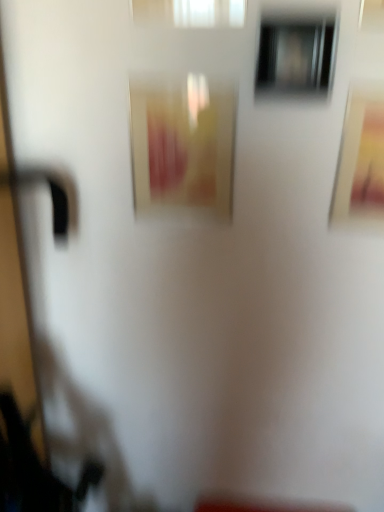
Find the location of a particular element. This screenshot has width=384, height=512. white translucent curtain at upper center, the 1th window when ordered from left to right is located at coordinates (191, 12).

Locate an element on the screen. The image size is (384, 512). matte gold picture frame at upper right, placed as the second picture frame when sorted from left to right is located at coordinates (360, 159).

Locate an element on the screen. The image size is (384, 512). transparent glass window at upper center, marked as the second window in a top-to-bottom arrangement is located at coordinates (296, 54).

What is the approximate width of transparent glass window at upper center, marked as the second window in a top-to-bottom arrangement?

It is 0.95 inches.

In order to click on white translucent curtain at upper center, acting as the 2th window starting from the bottom in this screenshot , I will do `click(191, 12)`.

Is matte yellow picture frame at center, the 1th picture frame positioned from the left, bigger or smaller than white translucent curtain at upper center, acting as the 2th window starting from the bottom?

Clearly, matte yellow picture frame at center, the 1th picture frame positioned from the left, is larger in size than white translucent curtain at upper center, acting as the 2th window starting from the bottom.

Could white translucent curtain at upper center, the 1th window when ordered from left to right, be considered to be inside matte yellow picture frame at center, placed as the second picture frame when sorted from right to left?

That's incorrect, white translucent curtain at upper center, the 1th window when ordered from left to right, is not inside matte yellow picture frame at center, placed as the second picture frame when sorted from right to left.

Consider the image. Are matte yellow picture frame at center, the 1th picture frame positioned from the left, and white translucent curtain at upper center, which ranks as the second window in right-to-left order, far apart?

They are positioned close to each other.

Which is more to the left, matte yellow picture frame at center, placed as the second picture frame when sorted from right to left, or matte gold picture frame at upper right, which is the 1th picture frame from right to left?

From the viewer's perspective, matte yellow picture frame at center, placed as the second picture frame when sorted from right to left, appears more on the left side.

Looking at this image, from a real-world perspective, is matte yellow picture frame at center, the 1th picture frame positioned from the left, physically below matte gold picture frame at upper right, which is the 1th picture frame from right to left?

Yes, from a real-world perspective, matte yellow picture frame at center, the 1th picture frame positioned from the left, is under matte gold picture frame at upper right, which is the 1th picture frame from right to left.

Does matte yellow picture frame at center, the 1th picture frame positioned from the left, come behind matte gold picture frame at upper right, placed as the second picture frame when sorted from left to right?

Yes, the depth of matte yellow picture frame at center, the 1th picture frame positioned from the left, is greater than that of matte gold picture frame at upper right, placed as the second picture frame when sorted from left to right.

Consider the image. Who is bigger, matte yellow picture frame at center, the 1th picture frame positioned from the left, or matte gold picture frame at upper right, placed as the second picture frame when sorted from left to right?

Bigger between the two is matte yellow picture frame at center, the 1th picture frame positioned from the left.

Is matte yellow picture frame at center, placed as the second picture frame when sorted from right to left, completely or partially inside white translucent curtain at upper center, which ranks as the second window in right-to-left order?

No, white translucent curtain at upper center, which ranks as the second window in right-to-left order, does not contain matte yellow picture frame at center, placed as the second picture frame when sorted from right to left.

Is white translucent curtain at upper center, the 1th window viewed from the top, next to matte yellow picture frame at center, the 1th picture frame positioned from the left, and touching it?

No, white translucent curtain at upper center, the 1th window viewed from the top, is not with matte yellow picture frame at center, the 1th picture frame positioned from the left.

I want to click on the 1st window counting from the right of the matte yellow picture frame at center, the 1th picture frame positioned from the left, so click(x=191, y=12).

In terms of width, does matte gold picture frame at upper right, which is the 1th picture frame from right to left, look wider or thinner when compared to white translucent curtain at upper center, which ranks as the second window in right-to-left order?

matte gold picture frame at upper right, which is the 1th picture frame from right to left, is wider than white translucent curtain at upper center, which ranks as the second window in right-to-left order.

Who is smaller, matte gold picture frame at upper right, placed as the second picture frame when sorted from left to right, or white translucent curtain at upper center, the 1th window when ordered from left to right?

Smaller between the two is matte gold picture frame at upper right, placed as the second picture frame when sorted from left to right.

How far apart are matte gold picture frame at upper right, placed as the second picture frame when sorted from left to right, and white translucent curtain at upper center, which ranks as the second window in right-to-left order?

They are 15.07 inches apart.

From a real-world perspective, is matte gold picture frame at upper right, which is the 1th picture frame from right to left, below white translucent curtain at upper center, which ranks as the second window in right-to-left order?

Yes, from a real-world perspective, matte gold picture frame at upper right, which is the 1th picture frame from right to left, is below white translucent curtain at upper center, which ranks as the second window in right-to-left order.

Is matte gold picture frame at upper right, which is the 1th picture frame from right to left, taller or shorter than transparent glass window at upper center, the 1th window in the right-to-left sequence?

matte gold picture frame at upper right, which is the 1th picture frame from right to left, is taller than transparent glass window at upper center, the 1th window in the right-to-left sequence.

From the picture: Considering the sizes of objects matte gold picture frame at upper right, placed as the second picture frame when sorted from left to right, and transparent glass window at upper center, which appears as the 1th window when ordered from the bottom, in the image provided, who is thinner, matte gold picture frame at upper right, placed as the second picture frame when sorted from left to right, or transparent glass window at upper center, which appears as the 1th window when ordered from the bottom,?

Thinner between the two is matte gold picture frame at upper right, placed as the second picture frame when sorted from left to right.

Is matte gold picture frame at upper right, which is the 1th picture frame from right to left, in contact with transparent glass window at upper center, the 2th window in the left-to-right sequence?

No.

In the image, is matte gold picture frame at upper right, which is the 1th picture frame from right to left, positioned in front of or behind transparent glass window at upper center, the 2th window in the left-to-right sequence?

matte gold picture frame at upper right, which is the 1th picture frame from right to left, is behind transparent glass window at upper center, the 2th window in the left-to-right sequence.

Is point (217, 13) in front of point (359, 211)?

Yes, it is in front of point (359, 211).

Which of these two, white translucent curtain at upper center, acting as the 2th window starting from the bottom, or matte gold picture frame at upper right, which is the 1th picture frame from right to left, is wider?

Wider between the two is matte gold picture frame at upper right, which is the 1th picture frame from right to left.

Can matte gold picture frame at upper right, placed as the second picture frame when sorted from left to right, be found inside white translucent curtain at upper center, the 1th window when ordered from left to right?

No, matte gold picture frame at upper right, placed as the second picture frame when sorted from left to right, is not a part of white translucent curtain at upper center, the 1th window when ordered from left to right.

From the matte gold picture frame at upper right, which is the 1th picture frame from right to left, count the 2nd window to the left and point to it. Please provide its 2D coordinates.

[(191, 12)]

Is matte gold picture frame at upper right, placed as the second picture frame when sorted from left to right, inside the boundaries of matte yellow picture frame at center, placed as the second picture frame when sorted from right to left, or outside?

matte gold picture frame at upper right, placed as the second picture frame when sorted from left to right, exists outside the volume of matte yellow picture frame at center, placed as the second picture frame when sorted from right to left.

Which is closer to the camera, (356,192) or (150,141)?

Point (356,192) appears to be farther away from the viewer than point (150,141).

Could you measure the distance between matte gold picture frame at upper right, placed as the second picture frame when sorted from left to right, and matte yellow picture frame at center, placed as the second picture frame when sorted from right to left?

12.89 inches.

Is matte gold picture frame at upper right, placed as the second picture frame when sorted from left to right, touching matte yellow picture frame at center, placed as the second picture frame when sorted from right to left?

No, matte gold picture frame at upper right, placed as the second picture frame when sorted from left to right, is not making contact with matte yellow picture frame at center, placed as the second picture frame when sorted from right to left.

Find the location of a particular element. The height and width of the screenshot is (512, 384). the 1st window counting from the right side of the matte yellow picture frame at center, the 1th picture frame positioned from the left is located at coordinates (191, 12).

Find the location of a particular element. The image size is (384, 512). picture frame located underneath the matte gold picture frame at upper right, placed as the second picture frame when sorted from left to right (from a real-world perspective) is located at coordinates (182, 146).

Which object lies nearer to the anchor point white translucent curtain at upper center, which ranks as the second window in right-to-left order, matte yellow picture frame at center, placed as the second picture frame when sorted from right to left, or transparent glass window at upper center, the 2th window in the left-to-right sequence?

transparent glass window at upper center, the 2th window in the left-to-right sequence.

Which object lies nearer to the anchor point matte gold picture frame at upper right, placed as the second picture frame when sorted from left to right, white translucent curtain at upper center, the 1th window when ordered from left to right, or transparent glass window at upper center, which appears as the 1th window when ordered from the bottom?

The object closer to matte gold picture frame at upper right, placed as the second picture frame when sorted from left to right, is transparent glass window at upper center, which appears as the 1th window when ordered from the bottom.

In the scene shown: Looking at the image, which one is located further to white translucent curtain at upper center, the 1th window viewed from the top, matte gold picture frame at upper right, placed as the second picture frame when sorted from left to right, or transparent glass window at upper center, the 1th window in the right-to-left sequence?

Based on the image, matte gold picture frame at upper right, placed as the second picture frame when sorted from left to right, appears to be further to white translucent curtain at upper center, the 1th window viewed from the top.

Based on their spatial positions, is transparent glass window at upper center, the 1th window in the right-to-left sequence, or matte gold picture frame at upper right, which is the 1th picture frame from right to left, further from white translucent curtain at upper center, the 1th window viewed from the top?

Based on the image, matte gold picture frame at upper right, which is the 1th picture frame from right to left, appears to be further to white translucent curtain at upper center, the 1th window viewed from the top.

Considering their positions, is white translucent curtain at upper center, the 1th window when ordered from left to right, positioned further to transparent glass window at upper center, which appears as the 1th window when ordered from the bottom, than matte gold picture frame at upper right, placed as the second picture frame when sorted from left to right?

matte gold picture frame at upper right, placed as the second picture frame when sorted from left to right, is further to transparent glass window at upper center, which appears as the 1th window when ordered from the bottom.

When comparing their distances from matte gold picture frame at upper right, which is the 1th picture frame from right to left, does white translucent curtain at upper center, the 1th window when ordered from left to right, or matte yellow picture frame at center, placed as the second picture frame when sorted from right to left, seem closer?

The object closer to matte gold picture frame at upper right, which is the 1th picture frame from right to left, is matte yellow picture frame at center, placed as the second picture frame when sorted from right to left.

Considering their positions, is matte yellow picture frame at center, the 1th picture frame positioned from the left, positioned closer to matte gold picture frame at upper right, which is the 1th picture frame from right to left, than white translucent curtain at upper center, which ranks as the second window in right-to-left order?

matte yellow picture frame at center, the 1th picture frame positioned from the left, is closer to matte gold picture frame at upper right, which is the 1th picture frame from right to left.

When comparing their distances from matte yellow picture frame at center, the 1th picture frame positioned from the left, does matte gold picture frame at upper right, which is the 1th picture frame from right to left, or transparent glass window at upper center, marked as the second window in a top-to-bottom arrangement, seem closer?

transparent glass window at upper center, marked as the second window in a top-to-bottom arrangement.

What are the coordinates of `window situated between white translucent curtain at upper center, the 1th window viewed from the top, and matte gold picture frame at upper right, placed as the second picture frame when sorted from left to right, from left to right` in the screenshot? It's located at (296, 54).

This screenshot has height=512, width=384. I want to click on window between white translucent curtain at upper center, the 1th window viewed from the top, and matte yellow picture frame at center, placed as the second picture frame when sorted from right to left, from top to bottom, so click(x=296, y=54).